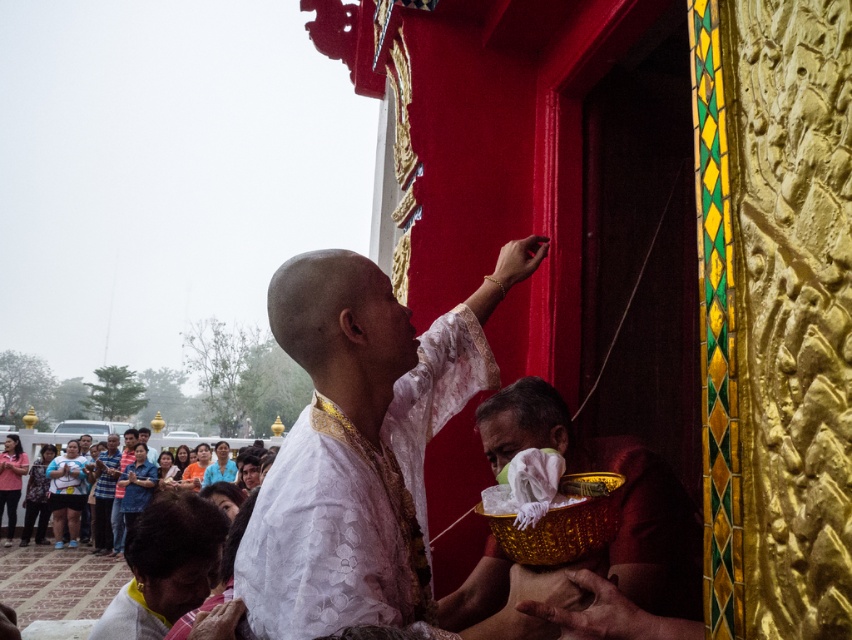
Question: Is white lace cloth at center further to the viewer compared to matte white shirt at center?

Choices:
 (A) no
 (B) yes

Answer: (A)

Question: Which point appears farthest from the camera in this image?

Choices:
 (A) (217, 468)
 (B) (167, 538)
 (C) (112, 481)

Answer: (C)

Question: Among these points, which one is farthest from the camera?

Choices:
 (A) (279, 344)
 (B) (232, 480)
 (C) (104, 552)
 (D) (147, 536)

Answer: (C)

Question: Among these objects, which one is nearest to the camera?

Choices:
 (A) white matte shirt at center
 (B) matte white shirt at center
 (C) blue fabric shirt at lower left

Answer: (A)

Question: Does matte white shirt at center lie in front of blue fabric shirt at lower left?

Choices:
 (A) no
 (B) yes

Answer: (A)

Question: Does white lace cloth at center lie behind white matte shirt at center?

Choices:
 (A) no
 (B) yes

Answer: (A)